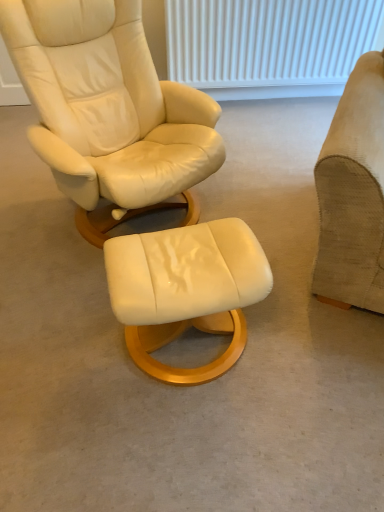
Locate an element on the screen. vacant position to the left of suede beige armchair at right is located at coordinates (262, 222).